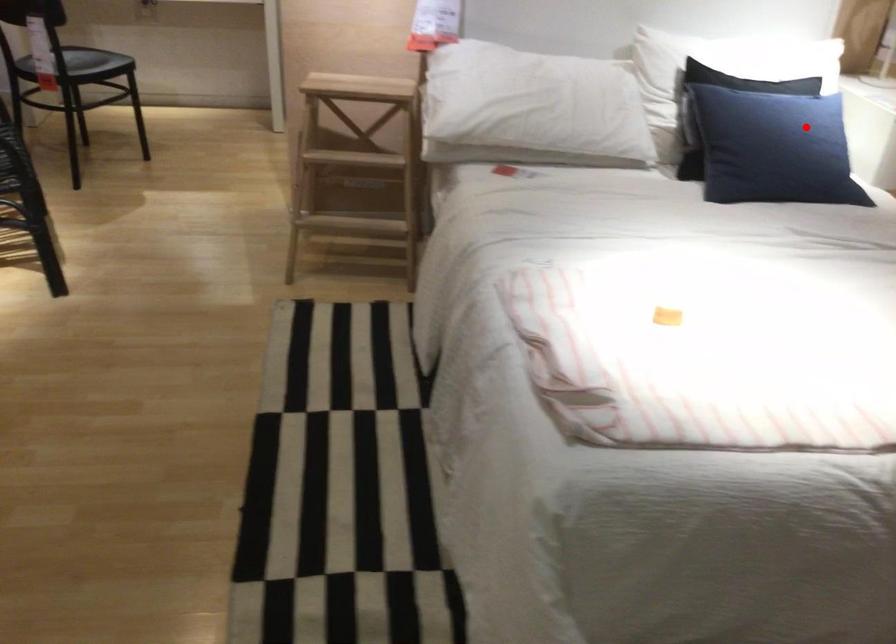
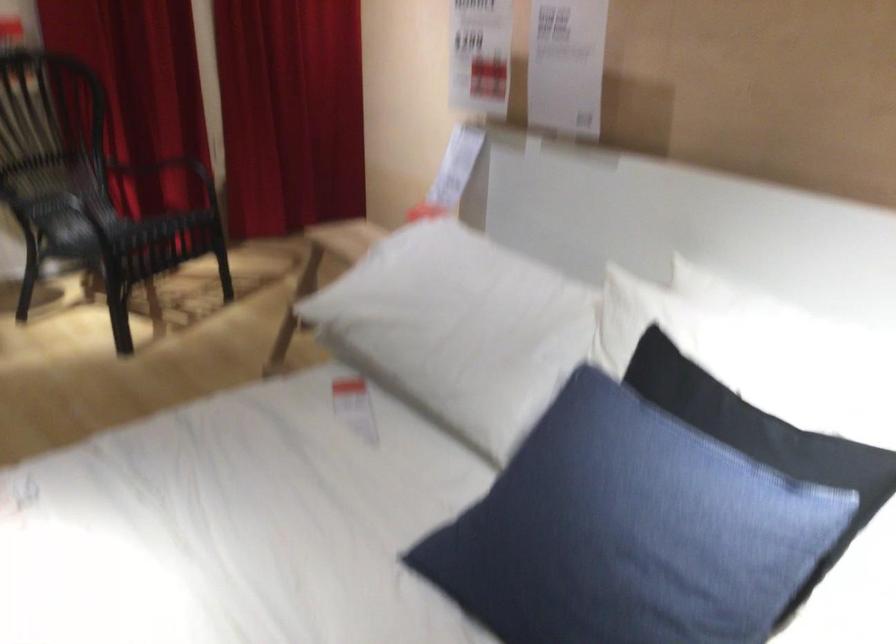
Locate, in the second image, the point that corresponds to the highlighted location in the first image.

(644, 536)